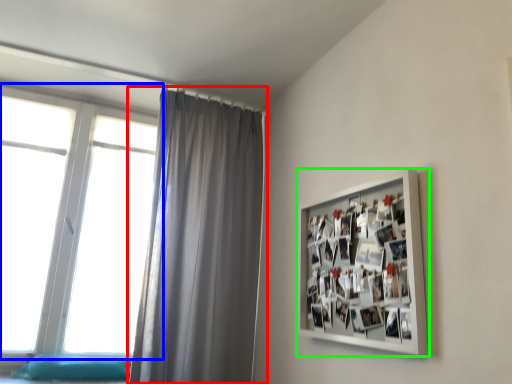
Question: Which is farther away from curtain (highlighted by a red box)? window (highlighted by a blue box) or picture frame (highlighted by a green box)?

Choices:
 (A) window
 (B) picture frame

Answer: (B)